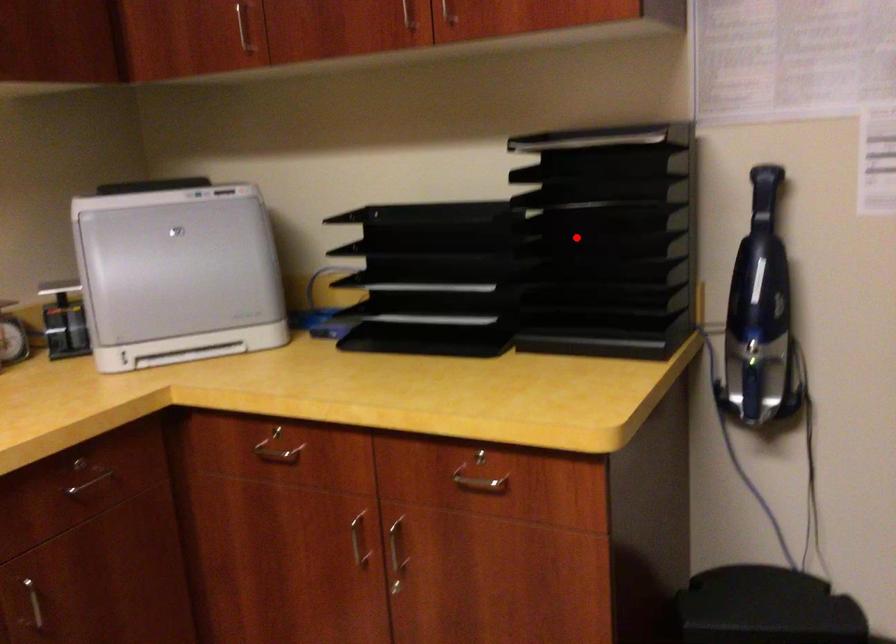
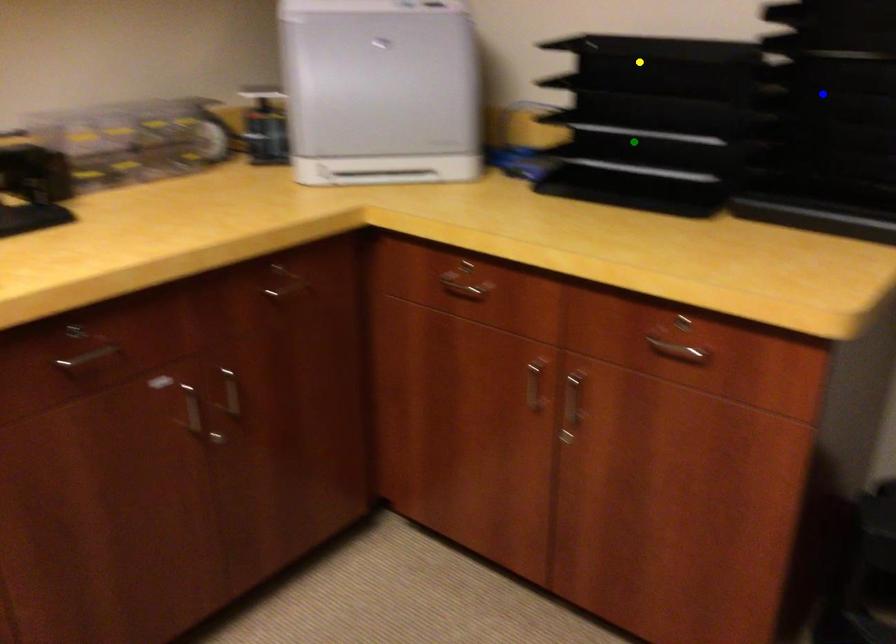
Question: I am providing you with two images of the same scene from different viewpoints. A red point is marked on the first image. You are given multiple points on the second image. Which mark in image 2 goes with the point in image 1?

Choices:
 (A) yellow point
 (B) blue point
 (C) green point

Answer: (B)